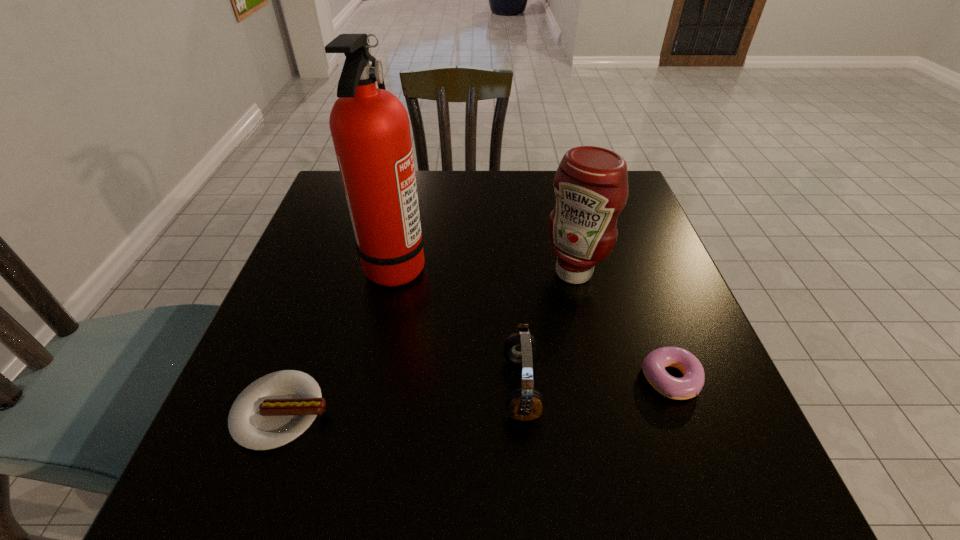
Locate an element on the screen. The width and height of the screenshot is (960, 540). fire extinguisher is located at coordinates (370, 128).

Where is `the fourth object from left to right`? the fourth object from left to right is located at coordinates (591, 183).

You are a GUI agent. You are given a task and a screenshot of the screen. Output one action in this format:
    pyautogui.click(x=<x>, y=<y>)
    Task: Click on the second tallest object
    This screenshot has height=540, width=960.
    Given the screenshot: What is the action you would take?
    pyautogui.click(x=591, y=183)

At what (x,y) coordinates should I click in order to perform the action: click on the third object from left to right. Please return your answer as a coordinate pair (x, y). This screenshot has height=540, width=960. Looking at the image, I should click on (524, 404).

Identify the location of headset. This screenshot has height=540, width=960. (524, 404).

You are a GUI agent. You are given a task and a screenshot of the screen. Output one action in this format:
    pyautogui.click(x=<x>, y=<y>)
    Task: Click on the rightmost object
    The height and width of the screenshot is (540, 960).
    Given the screenshot: What is the action you would take?
    pyautogui.click(x=654, y=364)

Locate an element on the screen. sausage is located at coordinates (274, 410).

This screenshot has height=540, width=960. I want to click on vacant region located 0.400m on the handle side of the tallest object, so click(602, 265).

Where is `vacant area situated 0.100m on the left of the condiment`? vacant area situated 0.100m on the left of the condiment is located at coordinates pyautogui.click(x=500, y=273).

Where is `free region located on the ear cups of the third object from right to left`? This screenshot has width=960, height=540. free region located on the ear cups of the third object from right to left is located at coordinates (316, 388).